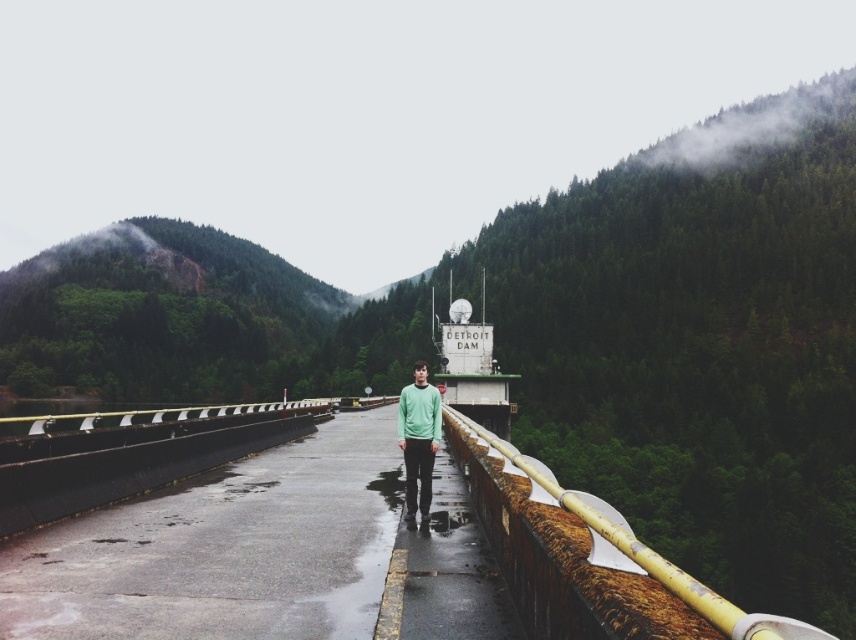
You are a hiker standing at the Detroit Dam pathway. You see a rusty metal railing at center and a green matte sweater at center. Which object is positioned to the right side from your perspective?

The rusty metal railing at center is to the right of the green matte sweater at center, so the rusty metal railing at center is positioned to the right side.

You are a hiker standing on the Detroit Dam pathway. You want to lean against the rusty metal railing at center while keeping your green matte sweater at center dry. The dam pathway is slippery due to the overcast weather. What should you do to maintain balance and avoid slipping?

The rusty metal railing at center and green matte sweater at center are 5.32 meters apart from each other. To maintain balance and keep the green matte sweater at center dry, you should move closer to the rusty metal railing at center so that the distance between them is reduced, allowing you to hold the railing securely while keeping your sweater away from the damp pathway.

You are standing at the Detroit Dam and want to take a photo of both the point at coordinates point (730, 604) and point (415, 408). Since you want to ensure both points are in focus, which point should you focus on to capture both in the same frame?

You should focus on point (415, 408) because it is farther from the camera than point (730, 604). By focusing on the farther point, the closer point will also be within the depth of field, ensuring both are in focus.